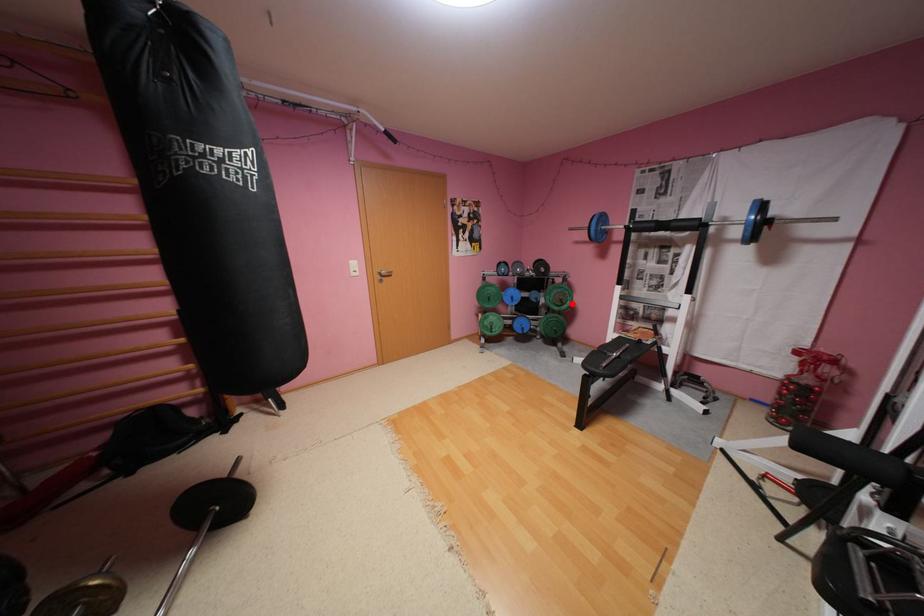
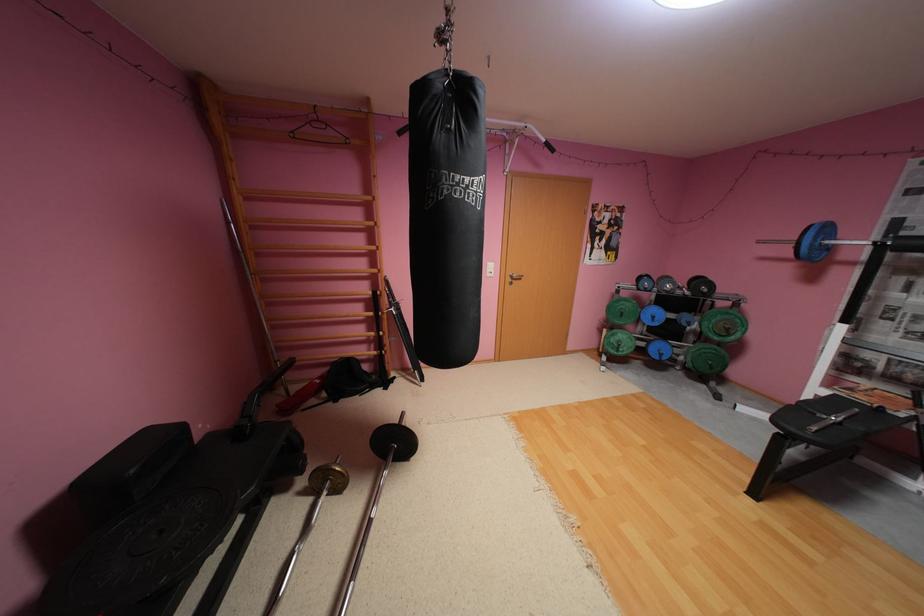
In the second image, find the point that corresponds to the highlighted location in the first image.

(737, 334)